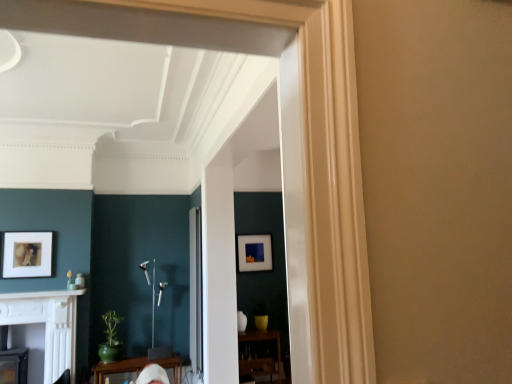
What do you see at coordinates (254, 253) in the screenshot? I see `matte black picture frame at center, the first picture frame from the back` at bounding box center [254, 253].

I want to click on wooden table at lower center, which is the second table in front-to-back order, so click(x=261, y=357).

What do you see at coordinates (27, 254) in the screenshot?
I see `matte white picture frame at left, the second picture frame when ordered from right to left` at bounding box center [27, 254].

The height and width of the screenshot is (384, 512). What do you see at coordinates (47, 325) in the screenshot?
I see `white glossy fireplace at lower left` at bounding box center [47, 325].

Identify the location of clear glass door at center. The width and height of the screenshot is (512, 384). (195, 293).

How much space does green glossy table at lower center, arranged as the 1th table when viewed from the front, occupy horizontally?

19.92 inches.

The height and width of the screenshot is (384, 512). Find the location of `matte black picture frame at center, the 2th picture frame positioned from the left`. matte black picture frame at center, the 2th picture frame positioned from the left is located at coordinates (254, 253).

Is white glossy fireplace at lower left outside of wooden table at lower center, the second table positioned from the left?

Absolutely, white glossy fireplace at lower left is external to wooden table at lower center, the second table positioned from the left.

Considering the positions of objects white glossy fireplace at lower left and wooden table at lower center, the second table positioned from the left, in the image provided, who is behind, white glossy fireplace at lower left or wooden table at lower center, the second table positioned from the left,?

wooden table at lower center, the second table positioned from the left, is behind.

Can you confirm if white glossy fireplace at lower left is smaller than wooden table at lower center, which is the second table in front-to-back order?

No.

How different are the orientations of white glossy fireplace at lower left and wooden table at lower center, which is the second table in front-to-back order, in degrees?

The angle between the facing direction of white glossy fireplace at lower left and the facing direction of wooden table at lower center, which is the second table in front-to-back order, is 0.748 degrees.

Which object is further away from the camera, white glossy fireplace at lower left or matte white picture frame at left, acting as the 2th picture frame starting from the back?

matte white picture frame at left, acting as the 2th picture frame starting from the back.

Locate an element on the screen. This screenshot has width=512, height=384. picture frame that is the 1st one when counting backward from the white glossy fireplace at lower left is located at coordinates (27, 254).

Which is in front, point (39, 299) or point (48, 245)?

Point (39, 299)

Which of these two, white glossy fireplace at lower left or matte white picture frame at left, the second picture frame when ordered from right to left, stands taller?

With more height is white glossy fireplace at lower left.

This screenshot has width=512, height=384. What are the coordinates of `table on the left of wooden table at lower center, the second table positioned from the left` in the screenshot? It's located at (138, 367).

From the image's perspective, would you say green glossy table at lower center, which is the second table from right to left, is shown under wooden table at lower center, marked as the 1th table in a back-to-front arrangement?

Actually, green glossy table at lower center, which is the second table from right to left, appears above wooden table at lower center, marked as the 1th table in a back-to-front arrangement, in the image.

From a real-world perspective, does green glossy table at lower center, arranged as the 1th table when viewed from the front, stand above wooden table at lower center, the second table positioned from the left?

No, from a real-world perspective, green glossy table at lower center, arranged as the 1th table when viewed from the front, is not above wooden table at lower center, the second table positioned from the left.

Considering the relative sizes of green glossy table at lower center, arranged as the 1th table when viewed from the front, and wooden table at lower center, which is the second table in front-to-back order, in the image provided, is green glossy table at lower center, arranged as the 1th table when viewed from the front, smaller than wooden table at lower center, which is the second table in front-to-back order,?

Actually, green glossy table at lower center, arranged as the 1th table when viewed from the front, might be larger than wooden table at lower center, which is the second table in front-to-back order.

Is white marble fireplace at lower left not near matte white picture frame at left, arranged as the 1th picture frame when viewed from the front?

Actually, white marble fireplace at lower left and matte white picture frame at left, arranged as the 1th picture frame when viewed from the front, are a little close together.

Who is more distant, white marble fireplace at lower left or matte white picture frame at left, arranged as the 1th picture frame when viewed from the front?

Positioned behind is matte white picture frame at left, arranged as the 1th picture frame when viewed from the front.

From the image's perspective, is white marble fireplace at lower left above matte white picture frame at left, arranged as the 1th picture frame when viewed from the front?

No, from the image's perspective, white marble fireplace at lower left is not above matte white picture frame at left, arranged as the 1th picture frame when viewed from the front.

Which point is more forward, (32, 296) or (29, 277)?

The point (32, 296) is in front.

In the scene shown: How different are the orientations of matte white picture frame at left, the second picture frame when ordered from right to left, and green glossy table at lower center, the first table viewed from the left, in degrees?

0.66 degrees.

Is matte white picture frame at left, the second picture frame when ordered from right to left, at the left side of green glossy table at lower center, the first table viewed from the left?

Yes.

Does matte white picture frame at left, arranged as the 1th picture frame when viewed from the front, have a larger size compared to green glossy table at lower center, the first table viewed from the left?

Actually, matte white picture frame at left, arranged as the 1th picture frame when viewed from the front, might be smaller than green glossy table at lower center, the first table viewed from the left.

Is matte white picture frame at left, arranged as the 1th picture frame when viewed from the front, surrounding green glossy table at lower center, the first table viewed from the left?

That's incorrect, green glossy table at lower center, the first table viewed from the left, is not inside matte white picture frame at left, arranged as the 1th picture frame when viewed from the front.

From the picture: From the image's perspective, is white marble fireplace at lower left above or below wooden table at lower center, the second table positioned from the left?

white marble fireplace at lower left is situated higher than wooden table at lower center, the second table positioned from the left, in the image.

From a real-world perspective, relative to wooden table at lower center, which is the 1th table from right to left, is white marble fireplace at lower left vertically above or below?

white marble fireplace at lower left is situated higher than wooden table at lower center, which is the 1th table from right to left, in the real world.

Considering the relative sizes of white marble fireplace at lower left and wooden table at lower center, marked as the 1th table in a back-to-front arrangement, in the image provided, is white marble fireplace at lower left shorter than wooden table at lower center, marked as the 1th table in a back-to-front arrangement,?

Yes.

Is matte black picture frame at center, the 2th picture frame positioned from the left, further to camera compared to white glossy fireplace at lower left?

Yes, it is.

Which of these two, matte black picture frame at center, which ranks as the 1th picture frame in right-to-left order, or white glossy fireplace at lower left, stands shorter?

With less height is matte black picture frame at center, which ranks as the 1th picture frame in right-to-left order.

From a real-world perspective, is matte black picture frame at center, the 2th picture frame positioned from the left, below white glossy fireplace at lower left?

No, from a real-world perspective, matte black picture frame at center, the 2th picture frame positioned from the left, is not below white glossy fireplace at lower left.

The width and height of the screenshot is (512, 384). I want to click on fireplace to the left of wooden table at lower center, which is the 1th table from right to left, so point(47,325).

This screenshot has height=384, width=512. There is a white glossy fireplace at lower left. What are the coordinates of `the 2nd picture frame above it (from a real-world perspective)` in the screenshot? It's located at (27, 254).

Estimate the real-world distances between objects in this image. Which object is closer to white glossy fireplace at lower left, matte white picture frame at left, acting as the 2th picture frame starting from the back, or clear glass door at center?

Among the two, matte white picture frame at left, acting as the 2th picture frame starting from the back, is located nearer to white glossy fireplace at lower left.

When comparing their distances from clear glass door at center, does white glossy fireplace at lower left or white marble fireplace at lower left seem further?

white marble fireplace at lower left lies further to clear glass door at center than the other object.

Estimate the real-world distances between objects in this image. Which object is further from green glossy table at lower center, which is the second table from right to left, wooden table at lower center, which is the second table in front-to-back order, or matte black picture frame at center, the 2th picture frame positioned from the left?

matte black picture frame at center, the 2th picture frame positioned from the left.

Considering their positions, is matte black picture frame at center, which ranks as the 1th picture frame in right-to-left order, positioned further to white marble fireplace at lower left than clear glass door at center?

matte black picture frame at center, which ranks as the 1th picture frame in right-to-left order, is positioned further to the anchor white marble fireplace at lower left.

Looking at the image, which one is located closer to white marble fireplace at lower left, wooden table at lower center, which is the 1th table from right to left, or matte black picture frame at center, the 2th picture frame positioned from the left?

The object closer to white marble fireplace at lower left is matte black picture frame at center, the 2th picture frame positioned from the left.

Looking at the image, which one is located further to green glossy table at lower center, the first table viewed from the left, wooden table at lower center, the second table positioned from the left, or white marble fireplace at lower left?

Among the two, white marble fireplace at lower left is located further to green glossy table at lower center, the first table viewed from the left.

Estimate the real-world distances between objects in this image. Which object is further from matte white picture frame at left, the second picture frame when ordered from right to left, matte black picture frame at center, which appears as the second picture frame when viewed from the front, or clear glass door at center?

matte black picture frame at center, which appears as the second picture frame when viewed from the front, is further to matte white picture frame at left, the second picture frame when ordered from right to left.

Looking at this image, looking at the image, which one is located further to matte white picture frame at left, the second picture frame when ordered from right to left, matte black picture frame at center, which ranks as the 1th picture frame in right-to-left order, or white marble fireplace at lower left?

The object further to matte white picture frame at left, the second picture frame when ordered from right to left, is matte black picture frame at center, which ranks as the 1th picture frame in right-to-left order.

This screenshot has height=384, width=512. Find the location of `glass door between matte white picture frame at left, acting as the 2th picture frame starting from the back, and matte black picture frame at center, the 2th picture frame positioned from the left, in the horizontal direction`. glass door between matte white picture frame at left, acting as the 2th picture frame starting from the back, and matte black picture frame at center, the 2th picture frame positioned from the left, in the horizontal direction is located at coordinates (195, 293).

This screenshot has width=512, height=384. Identify the location of picture frame located between white marble fireplace at lower left and wooden table at lower center, marked as the 1th table in a back-to-front arrangement, in the left-right direction. (254, 253).

Locate an element on the screen. The image size is (512, 384). table between white glossy fireplace at lower left and matte black picture frame at center, the 2th picture frame positioned from the left, from left to right is located at coordinates (138, 367).

At what (x,y) coordinates should I click in order to perform the action: click on table between white glossy fireplace at lower left and clear glass door at center. Please return your answer as a coordinate pair (x, y). This screenshot has height=384, width=512. Looking at the image, I should click on (138, 367).